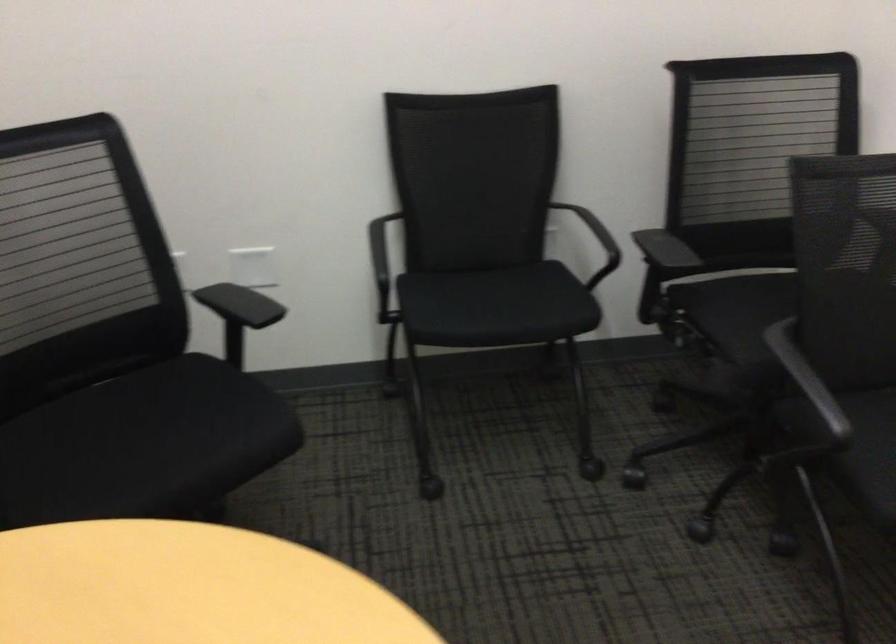
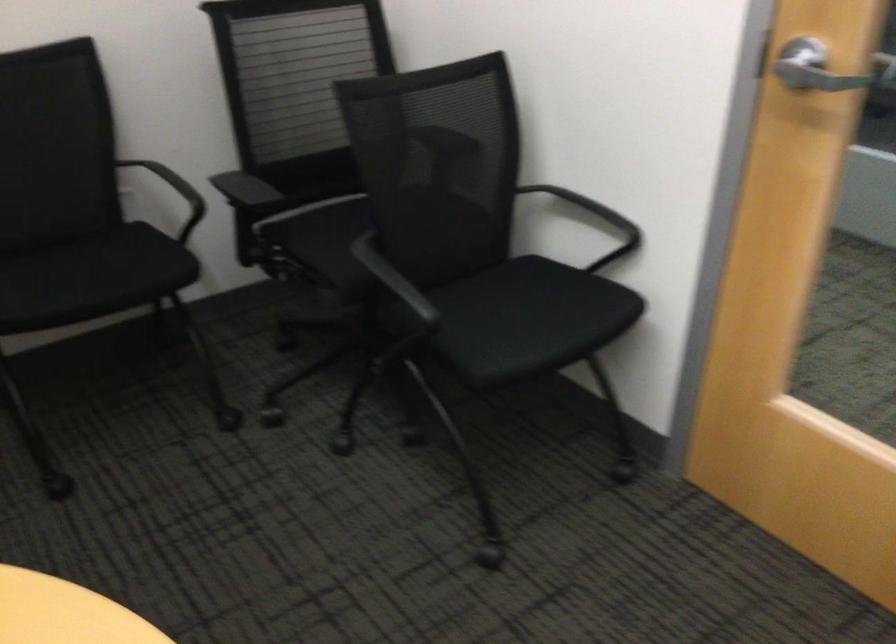
In the second image, find the point that corresponds to (495,308) in the first image.

(91, 278)